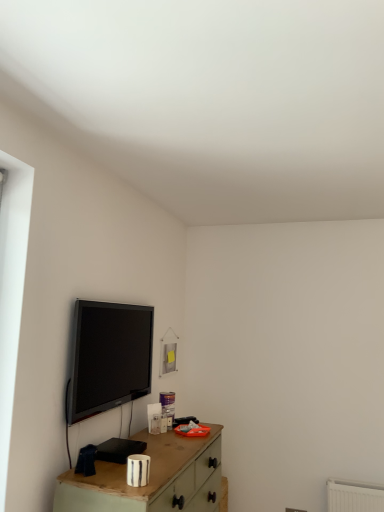
Question: Is wooden table at lower center at the right side of black glossy tv at upper left?

Choices:
 (A) yes
 (B) no

Answer: (A)

Question: Is wooden table at lower center beside black glossy tv at upper left?

Choices:
 (A) yes
 (B) no

Answer: (B)

Question: Are wooden table at lower center and black glossy tv at upper left far apart?

Choices:
 (A) no
 (B) yes

Answer: (A)

Question: From the image's perspective, does wooden table at lower center appear lower than black glossy tv at upper left?

Choices:
 (A) yes
 (B) no

Answer: (A)

Question: Is wooden table at lower center taller than black glossy tv at upper left?

Choices:
 (A) no
 (B) yes

Answer: (B)

Question: Considering the relative sizes of wooden table at lower center and black glossy tv at upper left in the image provided, is wooden table at lower center thinner than black glossy tv at upper left?

Choices:
 (A) no
 (B) yes

Answer: (A)

Question: Can you confirm if black glossy tv at upper left is positioned to the right of wooden table at lower center?

Choices:
 (A) yes
 (B) no

Answer: (B)

Question: Is black glossy tv at upper left touching wooden table at lower center?

Choices:
 (A) no
 (B) yes

Answer: (A)

Question: Would you say black glossy tv at upper left contains wooden table at lower center?

Choices:
 (A) no
 (B) yes

Answer: (A)

Question: Considering the relative sizes of black glossy tv at upper left and wooden table at lower center in the image provided, is black glossy tv at upper left smaller than wooden table at lower center?

Choices:
 (A) yes
 (B) no

Answer: (A)

Question: Are black glossy tv at upper left and wooden table at lower center located far from each other?

Choices:
 (A) no
 (B) yes

Answer: (A)

Question: Does black glossy tv at upper left appear on the left side of wooden table at lower center?

Choices:
 (A) yes
 (B) no

Answer: (A)

Question: From the image's perspective, is wooden table at lower center positioned above or below black glossy tv at upper left?

Choices:
 (A) below
 (B) above

Answer: (A)